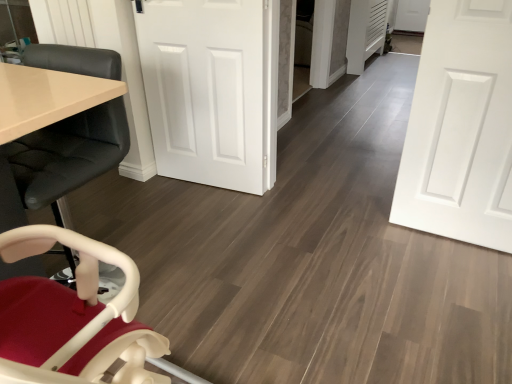
You are a GUI agent. You are given a task and a screenshot of the screen. Output one action in this format:
    pyautogui.click(x=<x>, y=<y>)
    Task: Click on the vacant region to the left of white smooth door at center, marked as the 2th door in a right-to-left arrangement
    This screenshot has height=384, width=512.
    Given the screenshot: What is the action you would take?
    pyautogui.click(x=136, y=196)